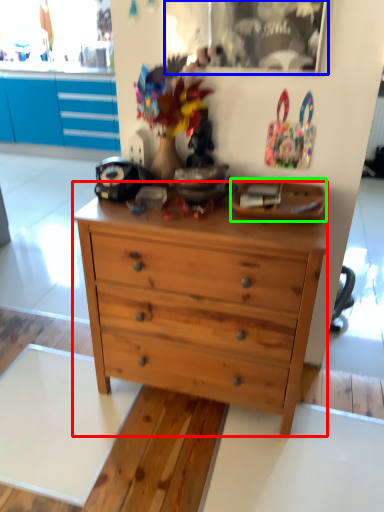
Question: Which object is the farthest from chest of drawers (highlighted by a red box)? Choose among these: picture frame (highlighted by a blue box) or plate (highlighted by a green box).

Choices:
 (A) picture frame
 (B) plate

Answer: (A)